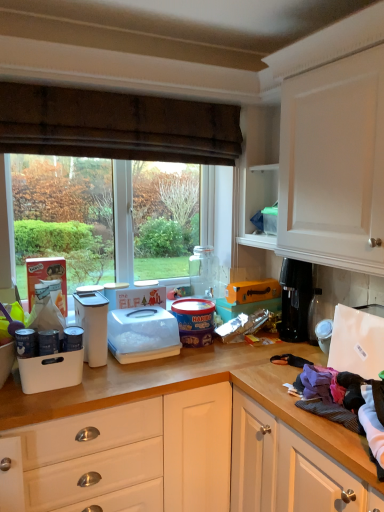
Where is `blank area beneath orange cardboard box at center, positioned as the first box in top-to-bottom order (from a real-world perspective)`? blank area beneath orange cardboard box at center, positioned as the first box in top-to-bottom order (from a real-world perspective) is located at coordinates (257, 296).